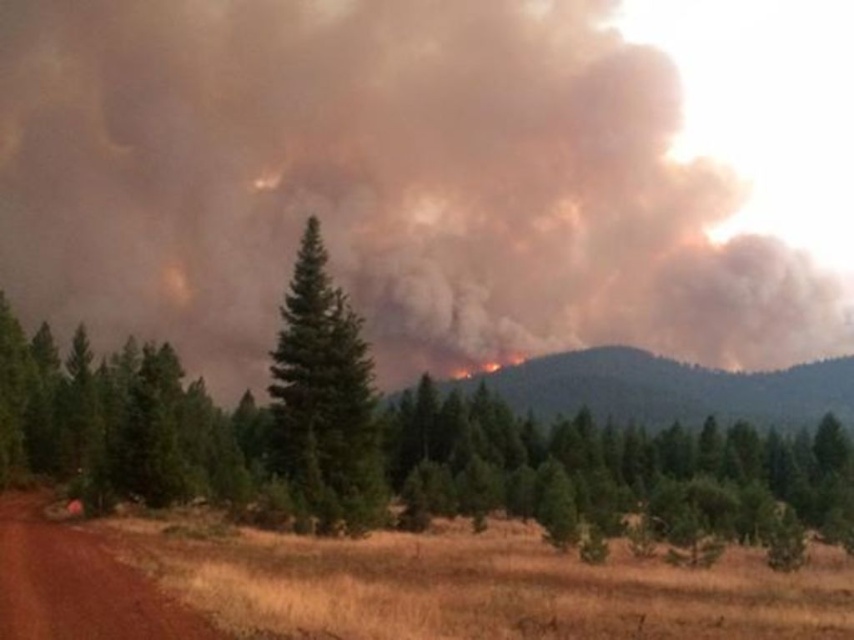
Question: Which is nearer to the charred vegetation at center?

Choices:
 (A) brown dirt track at lower left
 (B) brown smoke at upper center

Answer: (A)

Question: Is brown smoke at upper center closer to the viewer compared to brown dirt track at lower left?

Choices:
 (A) yes
 (B) no

Answer: (B)

Question: Which point is farther from the camera taking this photo?

Choices:
 (A) (580, 400)
 (B) (25, 627)
 (C) (544, 44)
 (D) (316, 268)

Answer: (C)

Question: Considering the real-world distances, which object is farthest from the charred vegetation at center?

Choices:
 (A) brown smoke at upper center
 (B) brown dirt track at lower left
 (C) green textured pine tree at center

Answer: (A)

Question: Where is brown smoke at upper center located in relation to green textured pine tree at center in the image?

Choices:
 (A) below
 (B) above

Answer: (B)

Question: Is brown smoke at upper center closer to the viewer compared to charred vegetation at center?

Choices:
 (A) no
 (B) yes

Answer: (B)